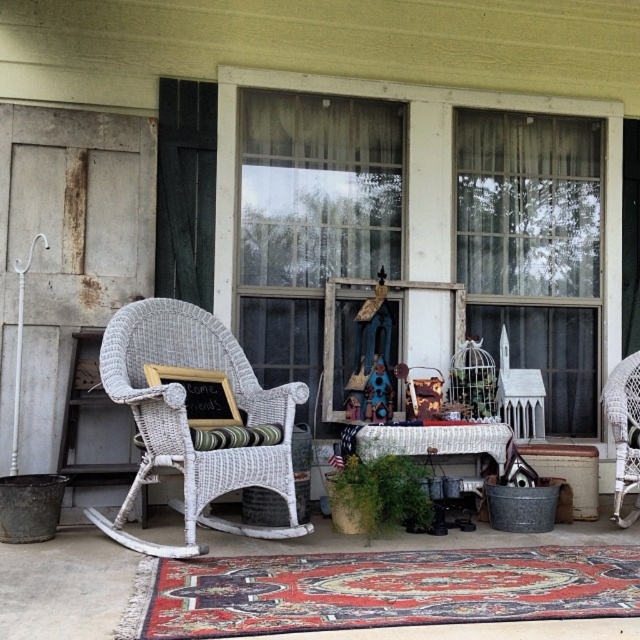
Question: Which point appears closest to the camera in this image?

Choices:
 (A) tap(636, 364)
 (B) tap(385, 420)
 (C) tap(280, 388)

Answer: (C)

Question: Which object is farther from the camera taking this photo?

Choices:
 (A) blue fabric doll at center
 (B) white wicker rocking chair at left

Answer: (A)

Question: From the image, what is the correct spatial relationship of white wicker chair at right in relation to blue fabric doll at center?

Choices:
 (A) left
 (B) right

Answer: (B)

Question: Does white wicker chair at right have a smaller size compared to blue fabric doll at center?

Choices:
 (A) yes
 (B) no

Answer: (B)

Question: Estimate the real-world distances between objects in this image. Which object is closer to the white wicker chair at right?

Choices:
 (A) white wicker rocking chair at left
 (B) blue fabric doll at center

Answer: (B)

Question: Observing the image, what is the correct spatial positioning of white wicker chair at right in reference to blue fabric doll at center?

Choices:
 (A) above
 (B) below

Answer: (B)